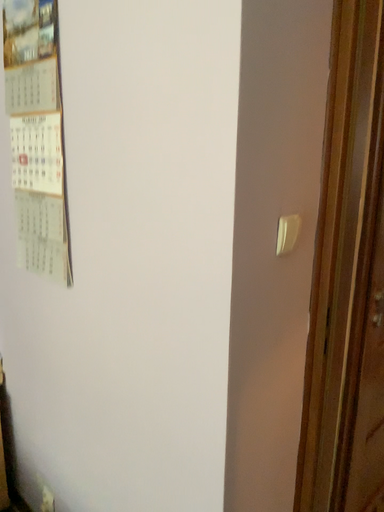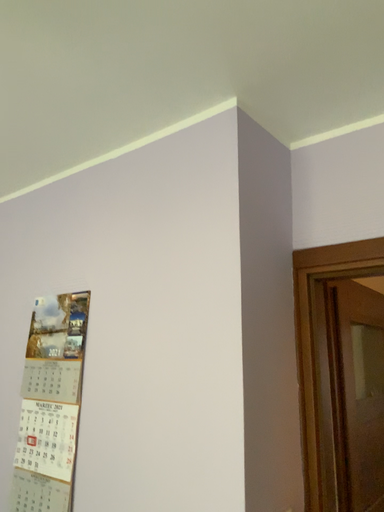
Question: How did the camera likely rotate when shooting the video?

Choices:
 (A) rotated left
 (B) rotated right

Answer: (B)